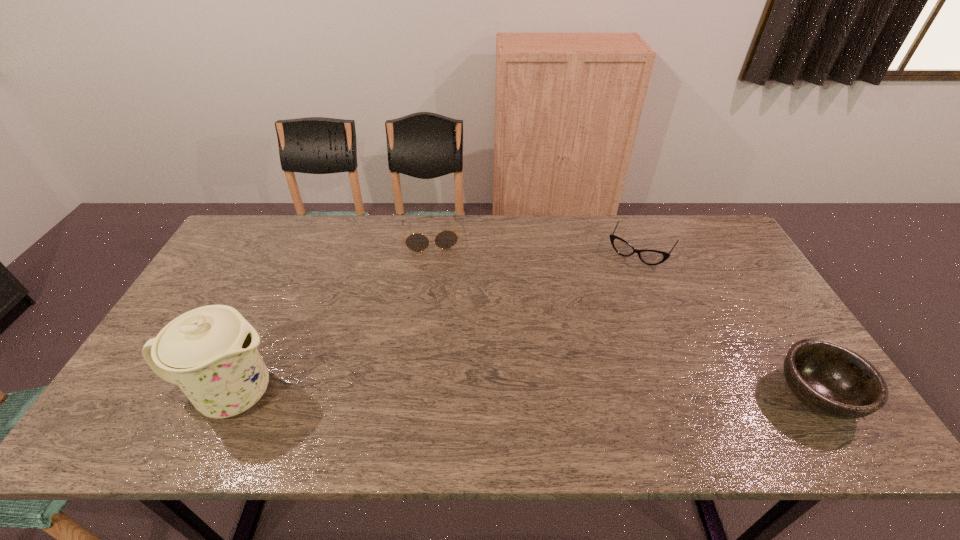
Find the location of a particular element. The height and width of the screenshot is (540, 960). the tallest object is located at coordinates (210, 352).

Identify the location of chinaware. (210, 352).

At what (x,y) coordinates should I click in order to perform the action: click on bowl. Please return your answer as a coordinate pair (x, y). This screenshot has height=540, width=960. Looking at the image, I should click on (833, 380).

This screenshot has width=960, height=540. In order to click on the rightmost object in this screenshot , I will do `click(833, 380)`.

Locate an element on the screen. the second object from right to left is located at coordinates (650, 257).

Find the location of a particular element. sunglasses is located at coordinates 417,242.

Where is `free location located on the spout of the tallest object`? The width and height of the screenshot is (960, 540). free location located on the spout of the tallest object is located at coordinates (444, 394).

Locate an element on the screen. The width and height of the screenshot is (960, 540). free location located on the back of the rightmost object is located at coordinates (731, 260).

Find the location of a particular element. The width and height of the screenshot is (960, 540). vacant point located 0.240m on the front-facing side of the spectacles is located at coordinates click(601, 316).

Find the location of a particular element. The width and height of the screenshot is (960, 540). vacant space located 0.210m on the front-facing side of the spectacles is located at coordinates (605, 309).